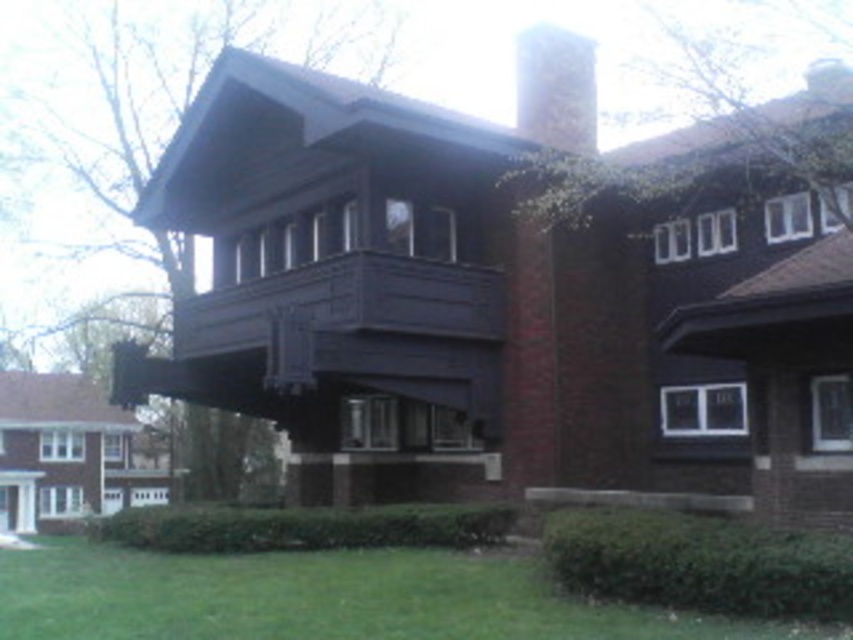
Question: Does green grass at lower center appear over white brick chimney at upper center?

Choices:
 (A) no
 (B) yes

Answer: (A)

Question: Among these objects, which one is nearest to the camera?

Choices:
 (A) white brick chimney at upper center
 (B) green grass at lower center

Answer: (B)

Question: Is green grass at lower center below white brick chimney at upper center?

Choices:
 (A) yes
 (B) no

Answer: (A)

Question: In this image, where is green grass at lower center located relative to white brick chimney at upper center?

Choices:
 (A) above
 (B) below

Answer: (B)